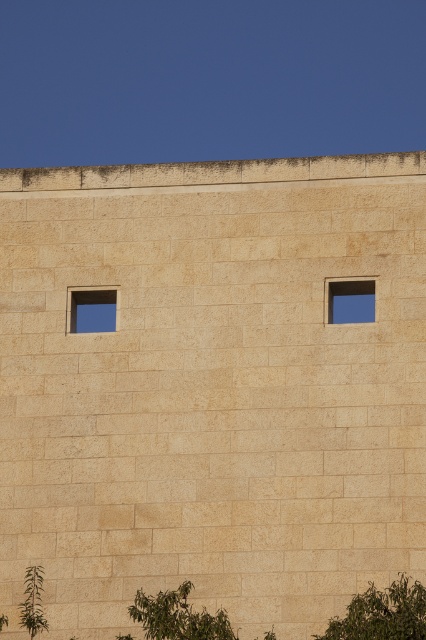
Based on the photo, you are a painter standing at the base of the stone wall. You need to paint both the transparent glass window at upper left and the beige stone window at upper right. If your ladder can reach up to 5 meters, can you safely paint both windows from the ground without moving the ladder?

The distance between the transparent glass window at upper left and the beige stone window at upper right is 7.41 meters. Since the ladder can only reach up to 5 meters, you cannot safely paint both windows from the ground without moving the ladder because the distance between them exceeds the ladder reach.

You are an architect designing a garden and want to place a new statue between the beige stone window at upper right and the green leafy plant at lower left. Based on their sizes, which object should the statue be closer to?

The beige stone window at upper right is not as tall as the green leafy plant at lower left, so the statue should be placed closer to the beige stone window at upper right to balance their sizes.